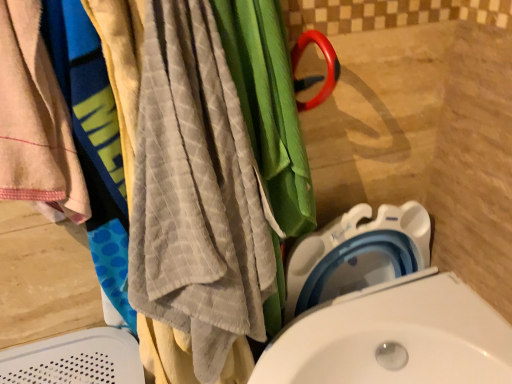
Question: From a real-world perspective, is gray textured towel at left physically above beige cotton towel at left?

Choices:
 (A) no
 (B) yes

Answer: (A)

Question: Considering the relative sizes of gray textured towel at left and beige cotton towel at left in the image provided, is gray textured towel at left thinner than beige cotton towel at left?

Choices:
 (A) yes
 (B) no

Answer: (B)

Question: Would you say gray textured towel at left is a long distance from beige cotton towel at left?

Choices:
 (A) yes
 (B) no

Answer: (B)

Question: Can you confirm if gray textured towel at left is smaller than beige cotton towel at left?

Choices:
 (A) yes
 (B) no

Answer: (B)

Question: Can you confirm if gray textured towel at left is bigger than beige cotton towel at left?

Choices:
 (A) yes
 (B) no

Answer: (A)

Question: Can you confirm if gray textured towel at left is positioned to the left of beige cotton towel at left?

Choices:
 (A) yes
 (B) no

Answer: (B)

Question: Is white plastic toilet at lower right shorter than beige cotton towel at left?

Choices:
 (A) yes
 (B) no

Answer: (B)

Question: Can you confirm if white plastic toilet at lower right is positioned to the left of beige cotton towel at left?

Choices:
 (A) no
 (B) yes

Answer: (A)

Question: Considering the relative sizes of white plastic toilet at lower right and beige cotton towel at left in the image provided, is white plastic toilet at lower right bigger than beige cotton towel at left?

Choices:
 (A) yes
 (B) no

Answer: (A)

Question: Is beige cotton towel at left a part of white plastic toilet at lower right?

Choices:
 (A) no
 (B) yes

Answer: (A)

Question: Is white plastic toilet at lower right further to the viewer compared to beige cotton towel at left?

Choices:
 (A) yes
 (B) no

Answer: (A)

Question: Is white plastic toilet at lower right positioned with its back to beige cotton towel at left?

Choices:
 (A) yes
 (B) no

Answer: (B)

Question: From the image's perspective, does beige cotton towel at left appear higher than white plastic toilet at lower right?

Choices:
 (A) yes
 (B) no

Answer: (A)